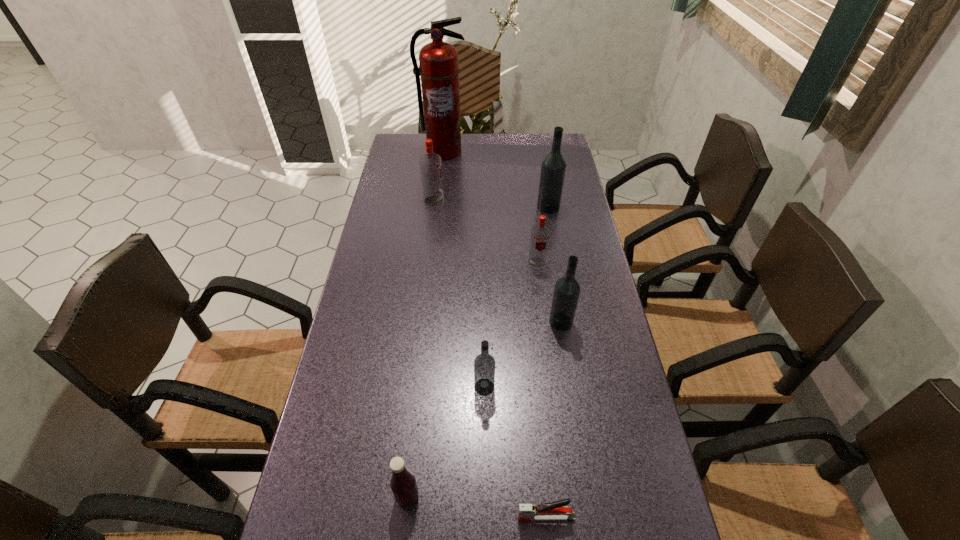
I want to click on the right red vodka, so click(x=540, y=234).

Where is `the third farthest vodka`? This screenshot has height=540, width=960. the third farthest vodka is located at coordinates (540, 234).

Locate an element on the screen. This screenshot has height=540, width=960. Tabasco sauce is located at coordinates (403, 484).

This screenshot has height=540, width=960. In order to click on the second nearest object in this screenshot , I will do `click(403, 484)`.

Where is `the shortest object`? the shortest object is located at coordinates (554, 510).

Find the location of a particular element. The height and width of the screenshot is (540, 960). gray stapler is located at coordinates (554, 510).

Locate an element on the screen. free space located on the nozzle side of the tallest object is located at coordinates (440, 188).

Identify the location of blank space located 0.250m on the front of the farthest black vodka. (559, 264).

This screenshot has width=960, height=540. I want to click on vacant space located on the front label of the farther red vodka, so click(549, 201).

Locate an element on the screen. The width and height of the screenshot is (960, 540). vacant space located 0.110m on the right of the second smallest black vodka is located at coordinates pos(612,322).